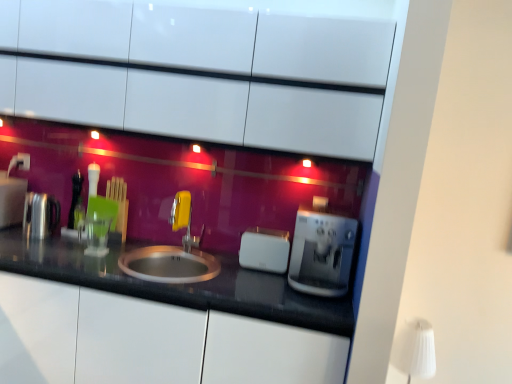
Question: Considering the relative sizes of yellow plastic faucet at center and white plastic electric outlet at upper left in the image provided, is yellow plastic faucet at center smaller than white plastic electric outlet at upper left?

Choices:
 (A) yes
 (B) no

Answer: (B)

Question: Can you confirm if yellow plastic faucet at center is shorter than white plastic electric outlet at upper left?

Choices:
 (A) no
 (B) yes

Answer: (A)

Question: Are yellow plastic faucet at center and white plastic electric outlet at upper left located far from each other?

Choices:
 (A) no
 (B) yes

Answer: (B)

Question: Is white plastic electric outlet at upper left at the back of yellow plastic faucet at center?

Choices:
 (A) no
 (B) yes

Answer: (A)

Question: Is yellow plastic faucet at center bigger than white plastic electric outlet at upper left?

Choices:
 (A) yes
 (B) no

Answer: (A)

Question: Does yellow plastic faucet at center have a lesser width compared to white plastic electric outlet at upper left?

Choices:
 (A) no
 (B) yes

Answer: (B)

Question: From a real-world perspective, does white plastic electric outlet at upper left stand above satin silver coffee machine at center?

Choices:
 (A) yes
 (B) no

Answer: (A)

Question: Are white plastic electric outlet at upper left and satin silver coffee machine at center making contact?

Choices:
 (A) no
 (B) yes

Answer: (A)

Question: Is white plastic electric outlet at upper left turned away from satin silver coffee machine at center?

Choices:
 (A) yes
 (B) no

Answer: (B)

Question: Considering the relative positions of white plastic electric outlet at upper left and satin silver coffee machine at center in the image provided, is white plastic electric outlet at upper left to the left of satin silver coffee machine at center from the viewer's perspective?

Choices:
 (A) yes
 (B) no

Answer: (A)

Question: Is white plastic electric outlet at upper left closer to the viewer compared to satin silver coffee machine at center?

Choices:
 (A) yes
 (B) no

Answer: (B)

Question: Is white plastic electric outlet at upper left facing towards satin silver coffee machine at center?

Choices:
 (A) no
 (B) yes

Answer: (A)

Question: From the image's perspective, does white plastic electric outlet at upper left appear lower than white fabric lampshade at upper right?

Choices:
 (A) no
 (B) yes

Answer: (A)